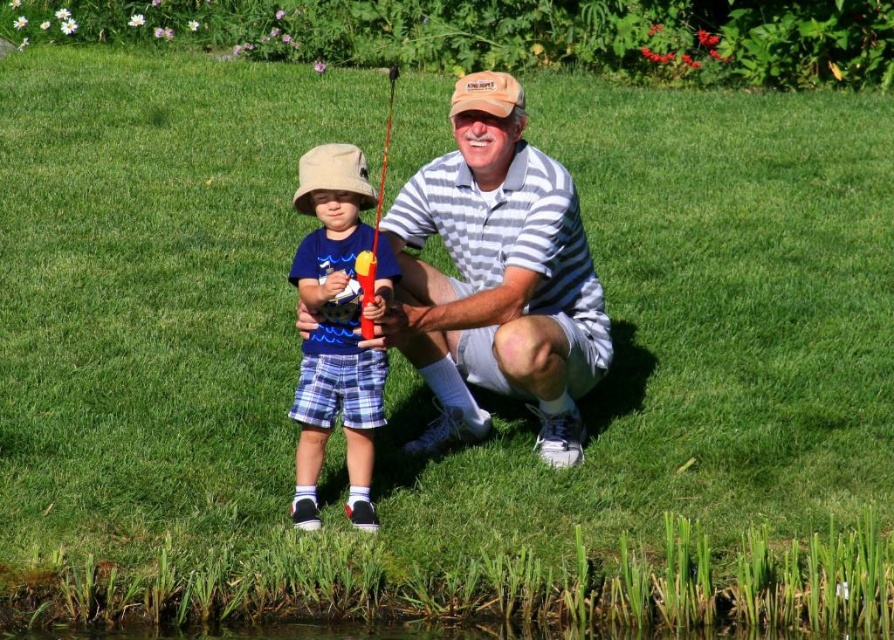
Question: Which point is farther from the camera taking this photo?

Choices:
 (A) (313, 177)
 (B) (377, 230)
 (C) (318, 156)
 (D) (490, 76)

Answer: (D)

Question: Which object is closer to the camera taking this photo?

Choices:
 (A) blue plaid shorts at center
 (B) tan fabric baseball cap at center
 (C) tan fabric baseball hat at center

Answer: (A)

Question: From the image, what is the correct spatial relationship of blue plaid shorts at center in relation to red plastic fishing pole at center?

Choices:
 (A) below
 (B) above

Answer: (A)

Question: Which object appears farthest from the camera in this image?

Choices:
 (A) red plastic fishing pole at center
 (B) tan fabric baseball cap at center
 (C) white striped polo shirt at center
 (D) blue plaid shorts at center

Answer: (B)

Question: Can you confirm if tan fabric baseball hat at center is positioned below tan fabric baseball cap at center?

Choices:
 (A) yes
 (B) no

Answer: (A)

Question: Is white striped polo shirt at center positioned behind blue plaid shorts at center?

Choices:
 (A) no
 (B) yes

Answer: (B)